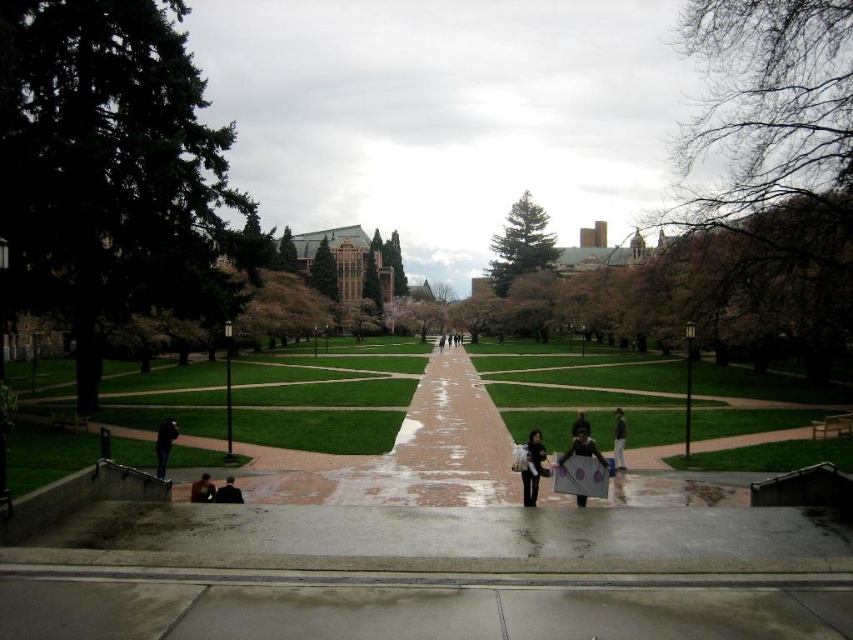
Question: From the image, what is the correct spatial relationship of matte gray paper at center in relation to dark brown leather jacket at center?

Choices:
 (A) above
 (B) below

Answer: (B)

Question: Which is nearer to the dark blue jeans at lower left?

Choices:
 (A) dark gray jacket at center
 (B) dark gray concrete figure at center

Answer: (A)

Question: Based on their relative distances, which object is farther from the dark blue jacket at lower left?

Choices:
 (A) dark brown leather jacket at center
 (B) dark gray concrete figure at center

Answer: (B)

Question: Does dark blue jeans at lower left have a greater width compared to dark brown leather jacket at center?

Choices:
 (A) yes
 (B) no

Answer: (A)

Question: Which point is farther from the camera taking this photo?

Choices:
 (A) click(x=616, y=445)
 (B) click(x=393, y=497)

Answer: (A)

Question: Is matte gray paper at center positioned at the back of dark gray jacket at center?

Choices:
 (A) no
 (B) yes

Answer: (A)